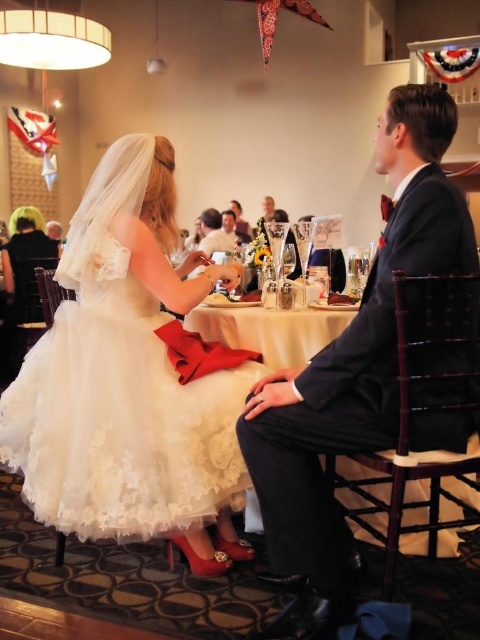
What is the 2D coordinate of the white lace tablecloth at center in the image?

The white lace tablecloth at center is located at the 2D coordinate point of (271,328).